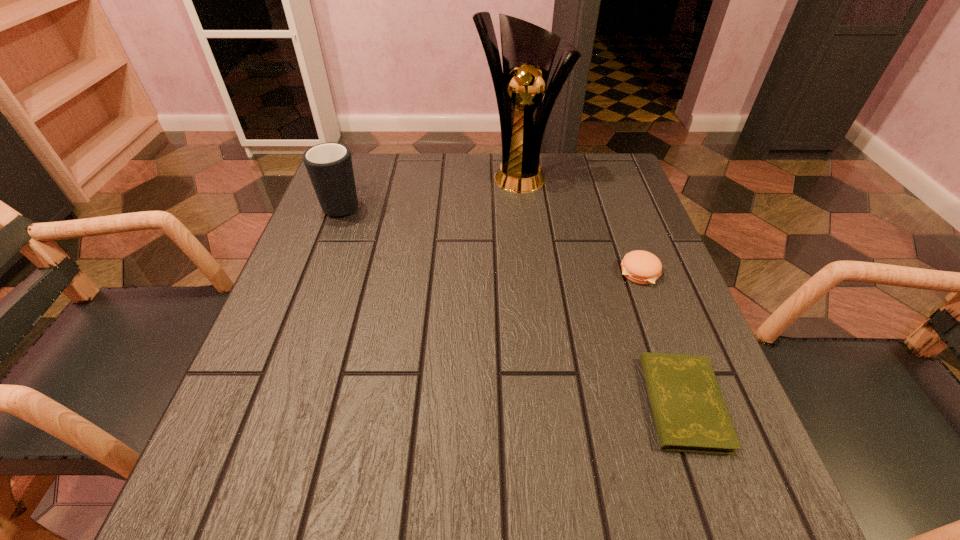
What are the coordinates of `free space located 0.160m on the side of the third shortest object with the handle` in the screenshot? It's located at [361, 154].

Where is `vacant space located 0.150m on the side of the third shortest object with the handle`? vacant space located 0.150m on the side of the third shortest object with the handle is located at coordinates (360, 157).

This screenshot has width=960, height=540. Identify the location of free location located on the left of the patty. (585, 273).

Where is `vacant space located 0.110m on the left of the diary`? vacant space located 0.110m on the left of the diary is located at coordinates (576, 403).

Where is `award that is at the far edge`? The width and height of the screenshot is (960, 540). award that is at the far edge is located at coordinates (528, 51).

You are a GUI agent. You are given a task and a screenshot of the screen. Output one action in this format:
    pyautogui.click(x=<x>, y=<y>)
    Task: Click on the mug that is at the far edge
    This screenshot has height=540, width=960.
    Given the screenshot: What is the action you would take?
    pyautogui.click(x=329, y=165)

Locate an element on the screen. Image resolution: width=960 pixels, height=540 pixels. object that is at the left edge is located at coordinates (329, 165).

The image size is (960, 540). What are the coordinates of `patty at the right edge` in the screenshot? It's located at (641, 267).

I want to click on diary that is at the right edge, so click(x=690, y=414).

Find the location of `object that is at the far left corner`. object that is at the far left corner is located at coordinates (329, 165).